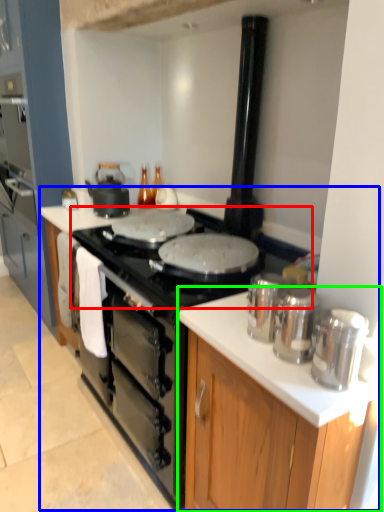
Question: Considering the real-world distances, which object is closest to gas stove (highlighted by a red box)? counter top (highlighted by a blue box) or cabinetry (highlighted by a green box).

Choices:
 (A) counter top
 (B) cabinetry

Answer: (A)